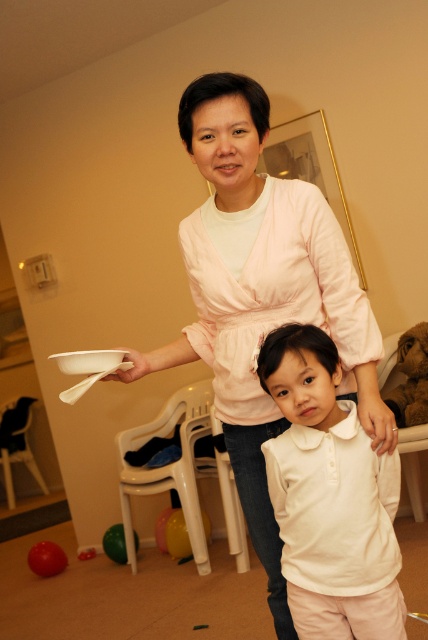
Based on the photo, you are standing in the room and want to place a small plant between the two points, point (77,356) and point (50,541). Which point should the plant be closer to in order to be nearer to the viewer?

The plant should be closer to point (77,356) because it is closer to the viewer than point (50,541).

You are a photographer setting up for a family photo. You notice the matte pink blouse at center and the white matte plate at upper left in the scene. Which object is positioned higher in the frame?

The matte pink blouse at center is taller than the white matte plate at upper left, so the matte pink blouse at center is positioned higher in the frame.